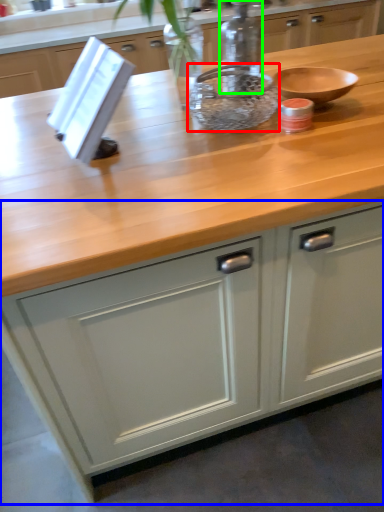
Question: Estimate the real-world distances between objects in this image. Which object is closer to bowl (highlighted by a red box), cabinetry (highlighted by a blue box) or bottle (highlighted by a green box)?

Choices:
 (A) cabinetry
 (B) bottle

Answer: (B)